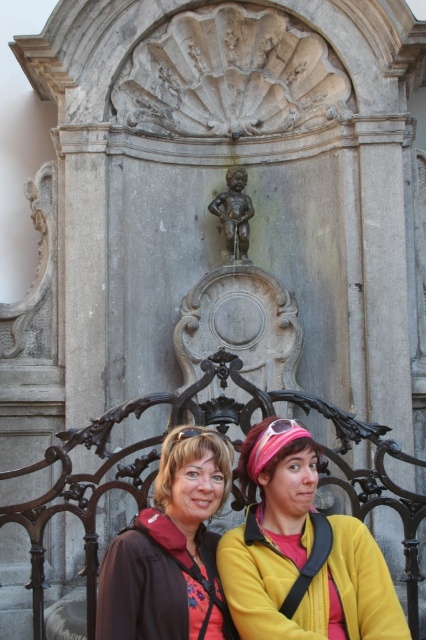
Is matte brown jacket at lower center below bronze statue at center?

Yes, matte brown jacket at lower center is below bronze statue at center.

Can you confirm if matte brown jacket at lower center is positioned above bronze statue at center?

No.

Find the location of a particular element. The height and width of the screenshot is (640, 426). matte brown jacket at lower center is located at coordinates (170, 550).

Where is `matte brown jacket at lower center`? This screenshot has height=640, width=426. matte brown jacket at lower center is located at coordinates (170, 550).

Looking at this image, is matte yellow jacket at center in front of matte brown jacket at lower center?

Yes, matte yellow jacket at center is in front of matte brown jacket at lower center.

Is matte yellow jacket at center behind matte brown jacket at lower center?

No, it is in front of matte brown jacket at lower center.

Identify the location of matte yellow jacket at center. This screenshot has width=426, height=640. (302, 580).

Measure the distance between matte yellow jacket at center and bronze statue at center.

They are 23.28 meters apart.

In the scene shown: Can you confirm if matte yellow jacket at center is bigger than bronze statue at center?

Yes, matte yellow jacket at center is bigger than bronze statue at center.

Between point (347, 545) and point (242, 188), which one is positioned in front?

Point (347, 545) is in front.

This screenshot has height=640, width=426. Identify the location of matte yellow jacket at center. (302, 580).